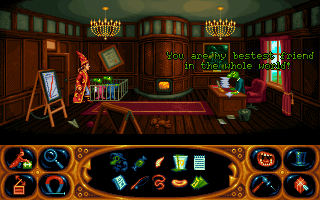
At what (x,y) coordinates should I click in order to perform the action: click on chandelier. Please return your answer as a coordinate pair (x, y). Looking at the image, I should click on (100, 26).